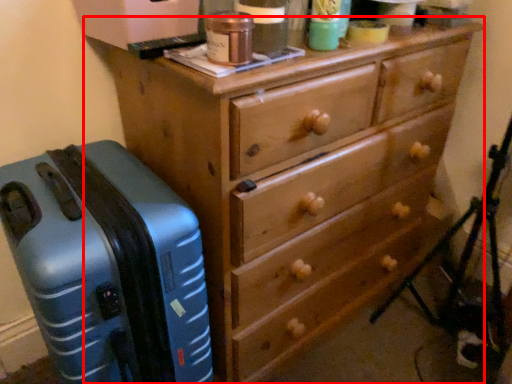
Question: Observing the image, what is the correct spatial positioning of chest of drawers (annotated by the red box) in reference to suitcase?

Choices:
 (A) right
 (B) left

Answer: (A)